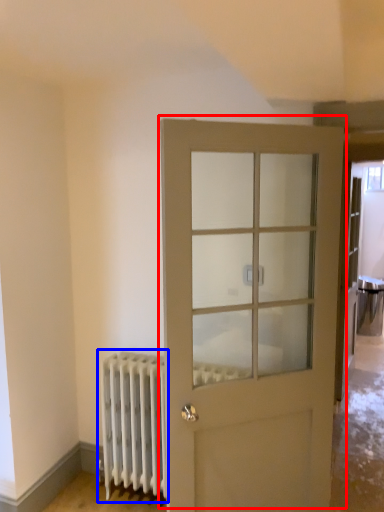
Question: Among these objects, which one is farthest to the camera, door (highlighted by a red box) or radiator (highlighted by a blue box)?

Choices:
 (A) door
 (B) radiator

Answer: (B)